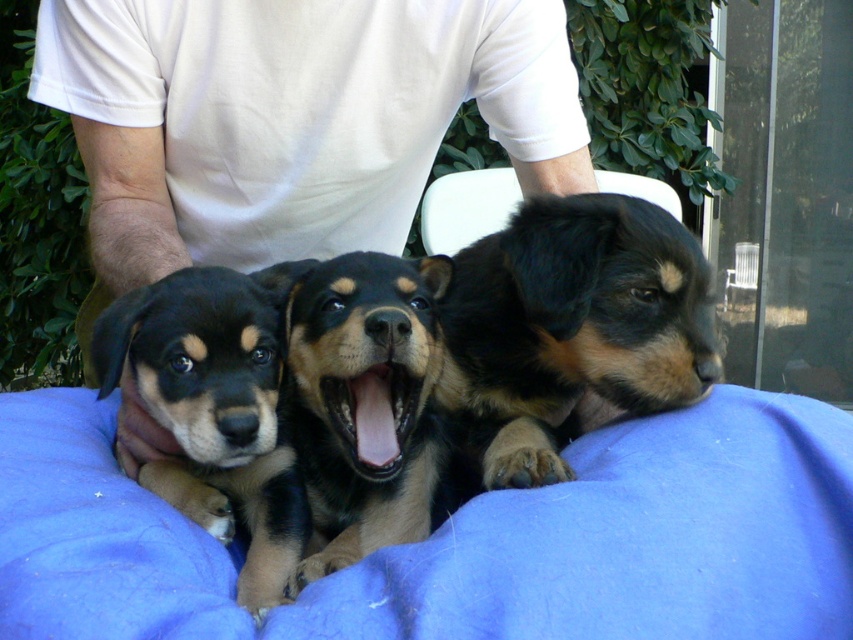
Question: Which object is the closest to the brown fuzzy dog at center?

Choices:
 (A) blue fabric at center
 (B) black fur dog at center
 (C) black fur puppy at left

Answer: (C)

Question: Can you confirm if black fur dog at center is smaller than black fur puppy at left?

Choices:
 (A) no
 (B) yes

Answer: (A)

Question: Can you confirm if blue fabric at center is bigger than brown fuzzy dog at center?

Choices:
 (A) yes
 (B) no

Answer: (A)

Question: Can you confirm if black fur puppy at left is bigger than brown fuzzy dog at center?

Choices:
 (A) yes
 (B) no

Answer: (A)

Question: Which point appears farthest from the camera in this image?

Choices:
 (A) (387, 602)
 (B) (709, 323)
 (C) (364, 532)

Answer: (C)

Question: Which point is closer to the camera?

Choices:
 (A) (375, 371)
 (B) (260, 486)
 (C) (531, 426)
 (D) (204, 572)

Answer: (D)